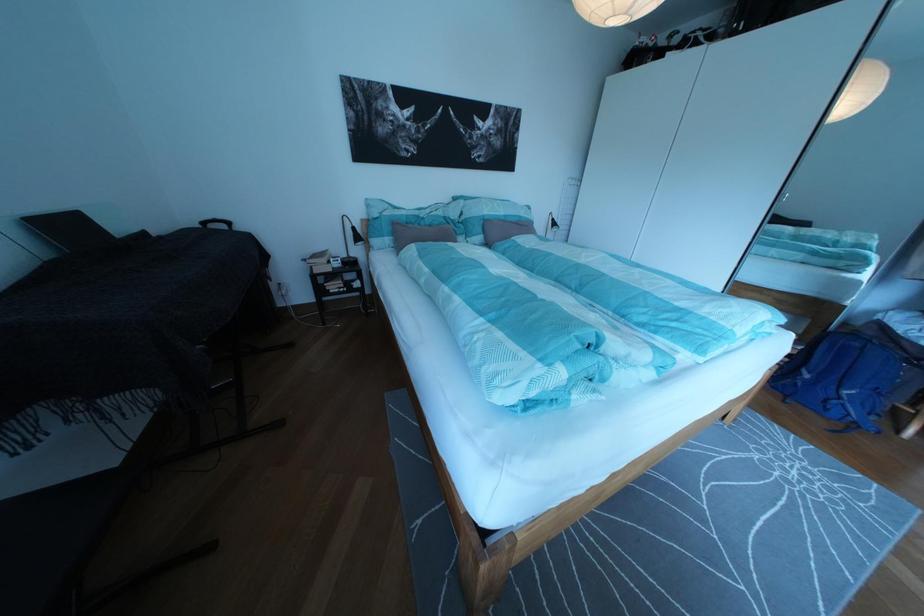
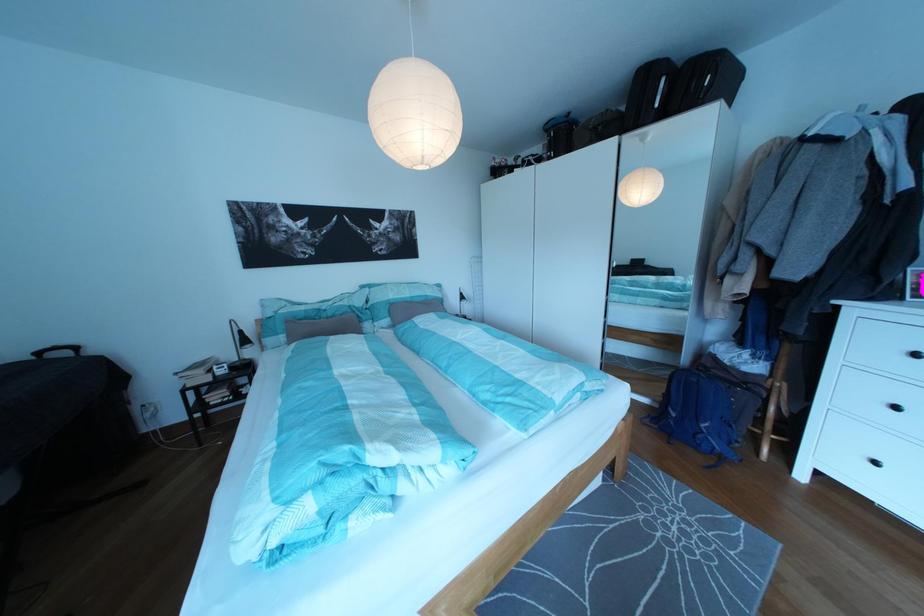
Where in the second image is the point corresponding to point (217, 229) from the first image?

(53, 360)